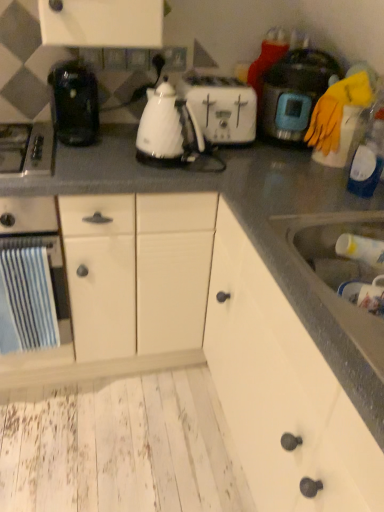
You are a GUI agent. You are given a task and a screenshot of the screen. Output one action in this format:
    pyautogui.click(x=<x>, y=<y>)
    Task: Click on the vacant area situated to the left side of white glossy electric kettle at center, which ranks as the second kitchen appliance in left-to-right order
    The width and height of the screenshot is (384, 512).
    Given the screenshot: What is the action you would take?
    pyautogui.click(x=104, y=158)